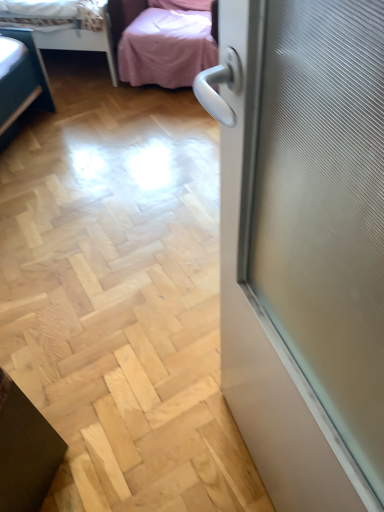
Question: Is pink fabric bed at upper left taller or shorter than pink fabric studio couch at upper center?

Choices:
 (A) tall
 (B) short

Answer: (B)

Question: Considering the positions of pink fabric bed at upper left and pink fabric studio couch at upper center in the image, is pink fabric bed at upper left wider or thinner than pink fabric studio couch at upper center?

Choices:
 (A) thin
 (B) wide

Answer: (B)

Question: From the image's perspective, is pink fabric bed at upper left located above or below pink fabric studio couch at upper center?

Choices:
 (A) below
 (B) above

Answer: (B)

Question: From a real-world perspective, is pink fabric studio couch at upper center physically located above or below pink fabric bed at upper left?

Choices:
 (A) above
 (B) below

Answer: (A)

Question: From their relative heights in the image, would you say pink fabric studio couch at upper center is taller or shorter than pink fabric bed at upper left?

Choices:
 (A) tall
 (B) short

Answer: (A)

Question: In the image, is pink fabric studio couch at upper center on the left side or the right side of pink fabric bed at upper left?

Choices:
 (A) left
 (B) right

Answer: (B)

Question: From the image's perspective, is pink fabric studio couch at upper center above or below pink fabric bed at upper left?

Choices:
 (A) above
 (B) below

Answer: (B)